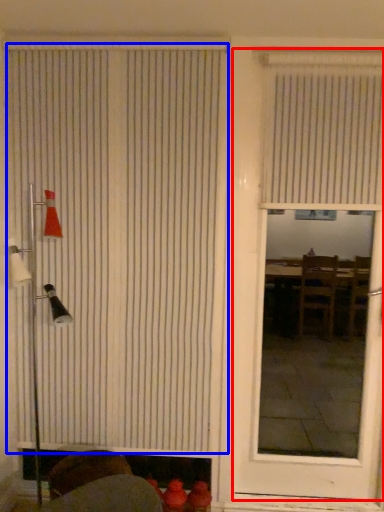
Question: Which object is further to the camera taking this photo, door (highlighted by a red box) or window blind (highlighted by a blue box)?

Choices:
 (A) door
 (B) window blind

Answer: (B)